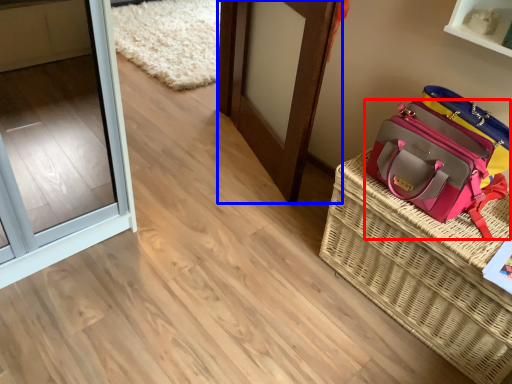
Question: Which object appears farthest to the camera in this image, handbag (highlighted by a red box) or door (highlighted by a blue box)?

Choices:
 (A) handbag
 (B) door

Answer: (B)